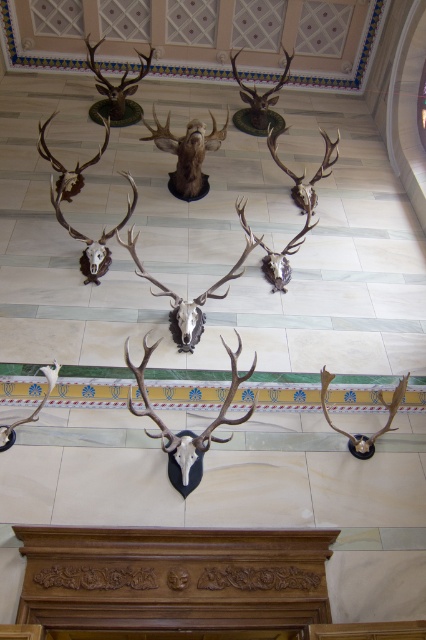
Which is more to the right, shiny brown antlers at lower right or silver metallic antlers at lower left?

From the viewer's perspective, shiny brown antlers at lower right appears more on the right side.

The height and width of the screenshot is (640, 426). Describe the element at coordinates (359, 433) in the screenshot. I see `shiny brown antlers at lower right` at that location.

I want to click on shiny brown antlers at lower right, so click(x=359, y=433).

Who is positioned more to the right, shiny brown antlers at center or matte silver antlers at center?

matte silver antlers at center is more to the right.

Is shiny brown antlers at center further to camera compared to matte silver antlers at center?

No, it is in front of matte silver antlers at center.

Who is more forward, (187,442) or (313,202)?

Point (187,442) is more forward.

Image resolution: width=426 pixels, height=640 pixels. I want to click on shiny brown antlers at center, so click(x=189, y=433).

Who is lower down, shiny brown antlers at center or shiny silver skull at center?

shiny brown antlers at center

Does point (230, 436) come farther from viewer compared to point (201, 321)?

No, (230, 436) is closer to viewer.

Image resolution: width=426 pixels, height=640 pixels. In order to click on shiny brown antlers at center in this screenshot , I will do `click(189, 433)`.